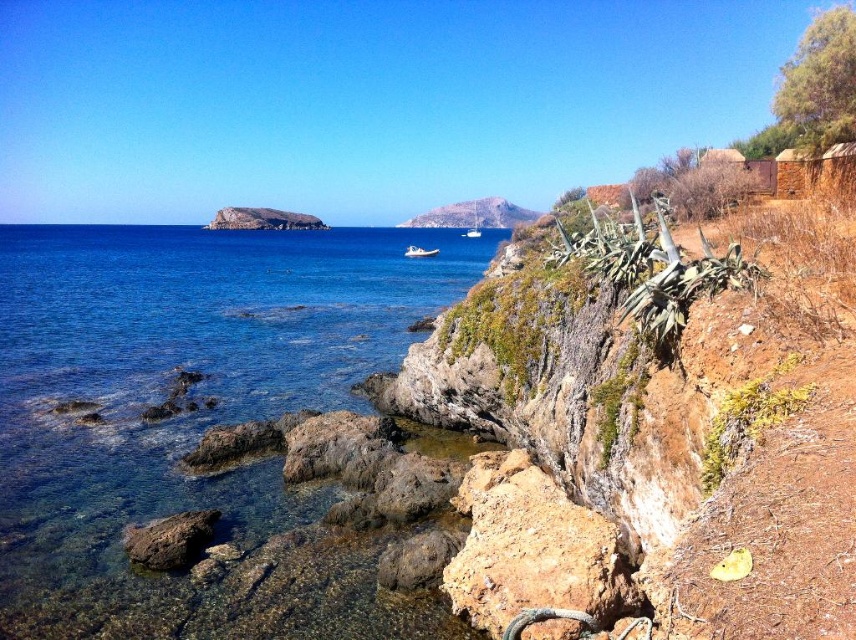
Question: Can you confirm if clear blue water at center is wider than brown rough rock at lower center?

Choices:
 (A) yes
 (B) no

Answer: (A)

Question: Considering the real-world distances, which object is farthest from the white rubber boat at center?

Choices:
 (A) clear blue water at center
 (B) brown rough rock at lower center

Answer: (B)

Question: Which object is farther from the camera taking this photo?

Choices:
 (A) rustic stone cliff at center
 (B) brown rough rock at lower center
 (C) brown rough rock at lower left

Answer: (A)

Question: Estimate the real-world distances between objects in this image. Which object is farther from the white rubber boat at center?

Choices:
 (A) rustic stone cliff at center
 (B) clear blue water at center

Answer: (A)

Question: Does clear blue water at center appear over brown rough rock at lower center?

Choices:
 (A) no
 (B) yes

Answer: (B)

Question: Does clear blue water at center have a greater width compared to brown rough rock at lower left?

Choices:
 (A) no
 (B) yes

Answer: (B)